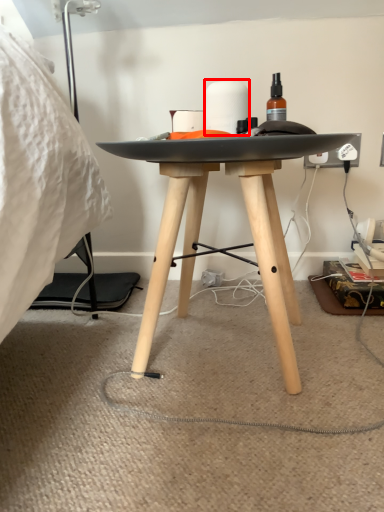
Question: Where is toilet paper (annotated by the red box) located in relation to string in the image?

Choices:
 (A) left
 (B) right

Answer: (B)